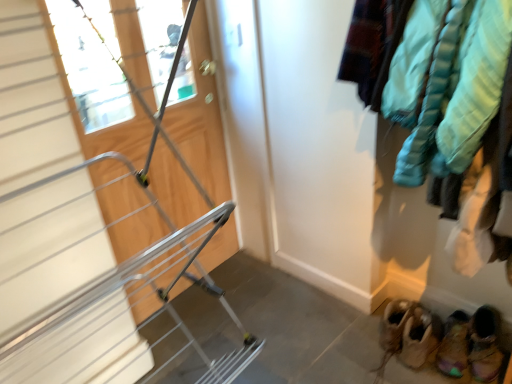
Question: From the image's perspective, would you say wooden door at center is shown under multicolored suede booties at lower right, placed as the 3th footwear when sorted from left to right?

Choices:
 (A) yes
 (B) no

Answer: (B)

Question: Is wooden door at center far from multicolored suede booties at lower right, placed as the 3th footwear when sorted from left to right?

Choices:
 (A) no
 (B) yes

Answer: (B)

Question: Could you tell me if wooden door at center is facing multicolored suede booties at lower right, placed as the 3th footwear when sorted from left to right?

Choices:
 (A) no
 (B) yes

Answer: (A)

Question: Is wooden door at center positioned behind multicolored suede booties at lower right, marked as the 1th footwear in a right-to-left arrangement?

Choices:
 (A) yes
 (B) no

Answer: (B)

Question: Is wooden door at center positioned in front of multicolored suede booties at lower right, marked as the 1th footwear in a right-to-left arrangement?

Choices:
 (A) no
 (B) yes

Answer: (B)

Question: Looking at their shapes, would you say brown suede moccasins at lower right, the 1th footwear in the left-to-right sequence, is wider or thinner than leather suede booties at lower right, the second footwear from the left?

Choices:
 (A) wide
 (B) thin

Answer: (A)

Question: Based on their sizes in the image, would you say brown suede moccasins at lower right, the third footwear in the right-to-left sequence, is bigger or smaller than leather suede booties at lower right, the second footwear from the left?

Choices:
 (A) small
 (B) big

Answer: (B)

Question: From a real-world perspective, is brown suede moccasins at lower right, the third footwear in the right-to-left sequence, positioned above or below leather suede booties at lower right, the second footwear from the left?

Choices:
 (A) above
 (B) below

Answer: (A)

Question: Is brown suede moccasins at lower right, the third footwear in the right-to-left sequence, in front of or behind leather suede booties at lower right, the second footwear from the left, in the image?

Choices:
 (A) behind
 (B) front

Answer: (A)

Question: Considering the positions of multicolored suede booties at lower right, marked as the 1th footwear in a right-to-left arrangement, and leather suede booties at lower right, the second footwear from the left, in the image, is multicolored suede booties at lower right, marked as the 1th footwear in a right-to-left arrangement, taller or shorter than leather suede booties at lower right, the second footwear from the left,?

Choices:
 (A) tall
 (B) short

Answer: (A)

Question: Is point (490, 375) closer or farther from the camera than point (438, 362)?

Choices:
 (A) closer
 (B) farther

Answer: (A)

Question: In the image, is multicolored suede booties at lower right, placed as the 3th footwear when sorted from left to right, positioned in front of or behind leather suede booties at lower right, the second footwear from the left?

Choices:
 (A) front
 (B) behind

Answer: (A)

Question: Is multicolored suede booties at lower right, marked as the 1th footwear in a right-to-left arrangement, wider or thinner than leather suede booties at lower right, the second footwear from the left?

Choices:
 (A) wide
 (B) thin

Answer: (B)

Question: Is brown suede moccasins at lower right, the third footwear in the right-to-left sequence, wider or thinner than multicolored suede booties at lower right, marked as the 1th footwear in a right-to-left arrangement?

Choices:
 (A) thin
 (B) wide

Answer: (B)

Question: Is brown suede moccasins at lower right, the third footwear in the right-to-left sequence, to the left or to the right of multicolored suede booties at lower right, placed as the 3th footwear when sorted from left to right, in the image?

Choices:
 (A) left
 (B) right

Answer: (A)